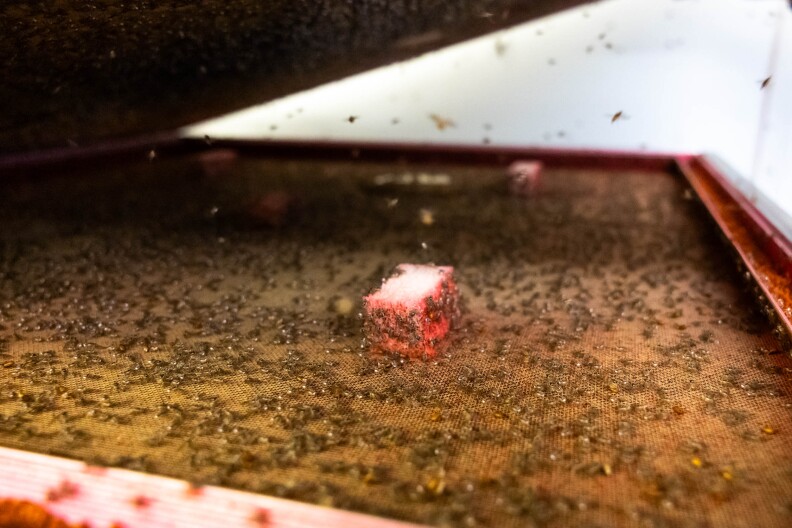
At what (x,y) coordinates should I click in order to perform the action: click on brown trim. Please return your answer as a coordinate pair (x, y). The image size is (792, 528). Looking at the image, I should click on point(722,208).